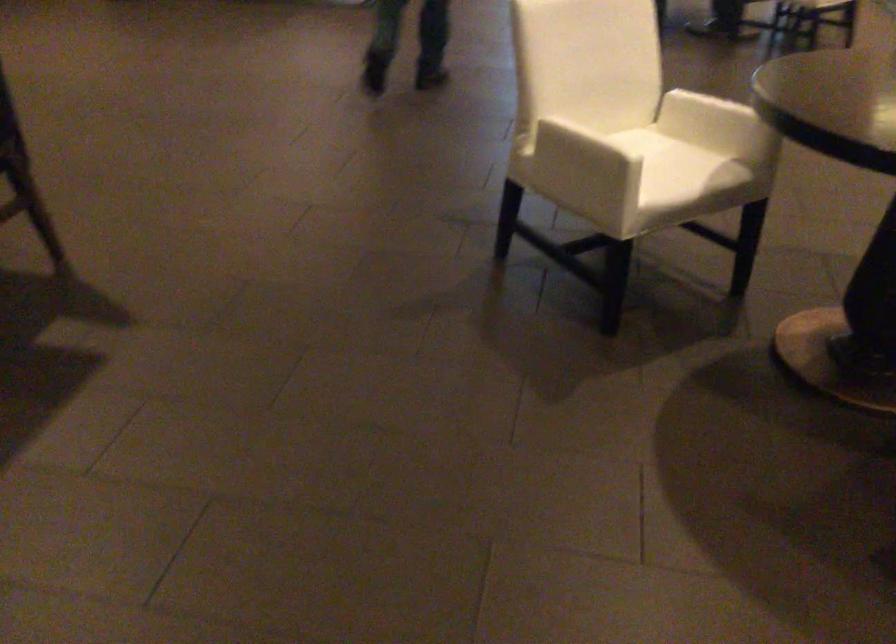
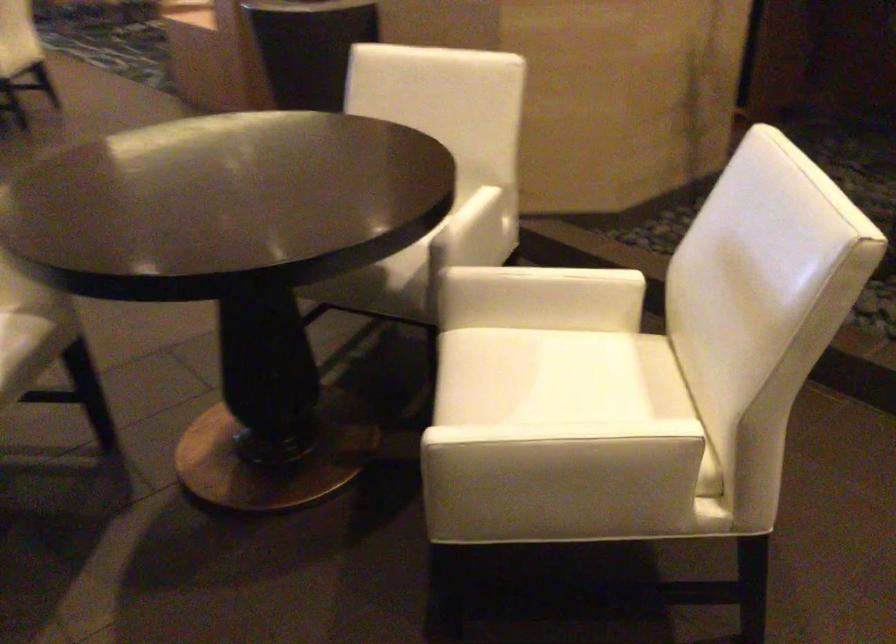
Question: The images are taken continuously from a first-person perspective. In which direction is your viewpoint rotating?

Choices:
 (A) Left
 (B) Right
 (C) Up
 (D) Down

Answer: (B)